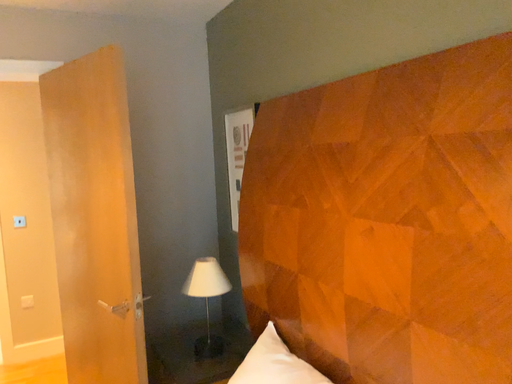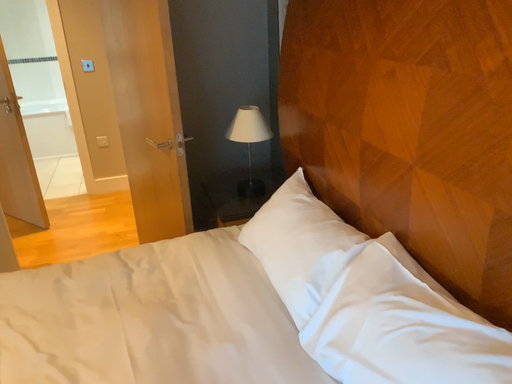
Question: How did the camera likely rotate when shooting the video?

Choices:
 (A) rotated upward
 (B) rotated downward

Answer: (B)